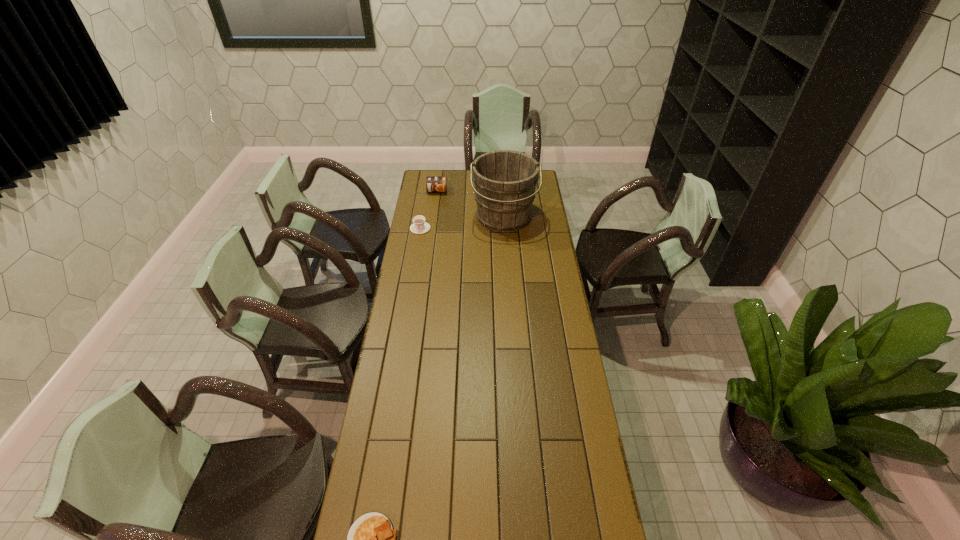
Identify the location of free area in between the tallest object and the second tallest object. (470, 205).

Where is `free space between the second shortest object and the bucket`? The image size is (960, 540). free space between the second shortest object and the bucket is located at coordinates (462, 224).

Find the location of a particular element. This screenshot has height=540, width=960. vacant space in between the tallest object and the third tallest object is located at coordinates (462, 224).

Image resolution: width=960 pixels, height=540 pixels. Identify the location of empty space between the teacup and the farthest object. (429, 210).

Select which object is the second closest to the second shortest object. Please provide its 2D coordinates. Your answer should be formatted as a tuple, i.e. [(x, y)], where the tuple contains the x and y coordinates of a point satisfying the conditions above.

[(433, 183)]

At what (x,y) coordinates should I click in order to perform the action: click on the closest object to the teacup. Please return your answer as a coordinate pair (x, y). Looking at the image, I should click on (505, 180).